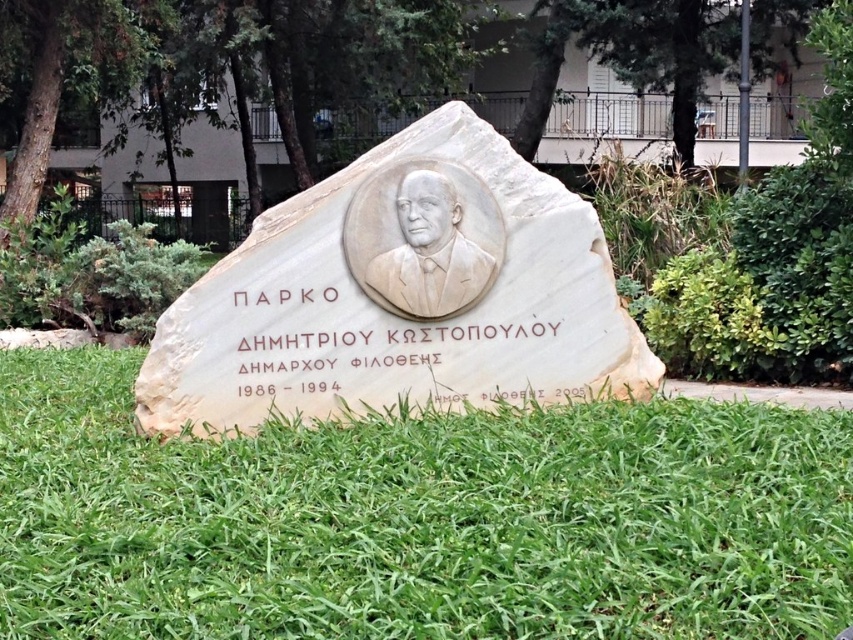
Question: From the image, what is the correct spatial relationship of green grass at center in relation to white marble plaque at center?

Choices:
 (A) above
 (B) below

Answer: (B)

Question: Which point is farther to the camera?

Choices:
 (A) white marble plaque at center
 (B) white marble bust at center
 (C) green grass at center

Answer: (B)

Question: Considering the relative positions of white marble plaque at center and white marble bust at center in the image provided, where is white marble plaque at center located with respect to white marble bust at center?

Choices:
 (A) right
 (B) left

Answer: (B)

Question: Which of the following is the closest to the observer?

Choices:
 (A) white marble bust at center
 (B) white marble plaque at center

Answer: (B)

Question: Which of these objects is positioned closest to the white marble plaque at center?

Choices:
 (A) green grass at center
 (B) white marble bust at center

Answer: (B)

Question: Can you confirm if green grass at center is positioned to the left of white marble bust at center?

Choices:
 (A) no
 (B) yes

Answer: (B)